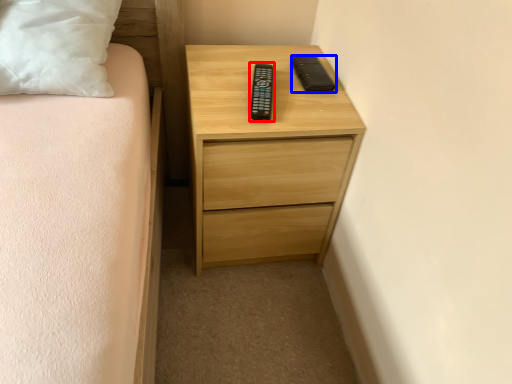
Question: Among these objects, which one is farthest to the camera, control (highlighted by a red box) or gadget (highlighted by a blue box)?

Choices:
 (A) control
 (B) gadget

Answer: (B)